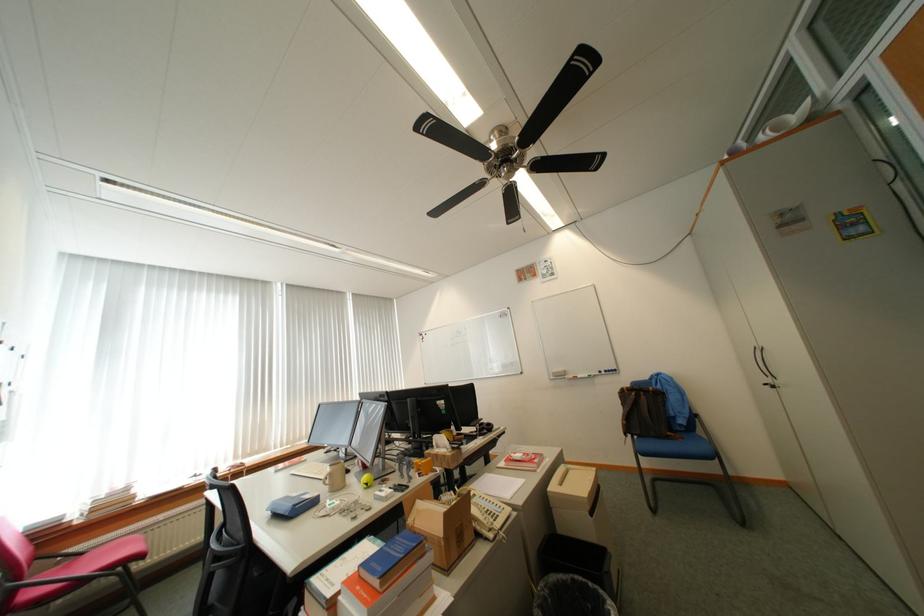
The height and width of the screenshot is (616, 924). Describe the element at coordinates (482, 528) in the screenshot. I see `the telephone handset` at that location.